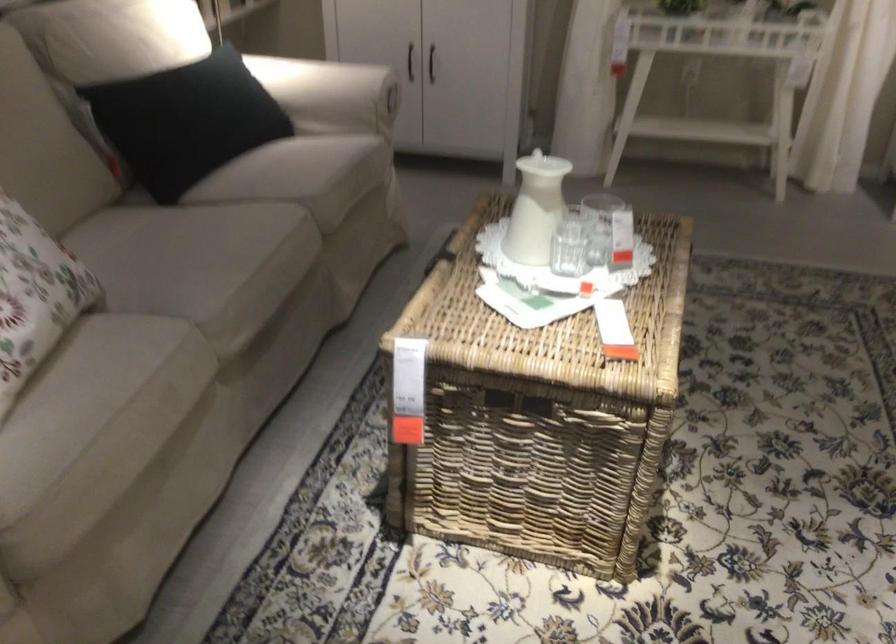
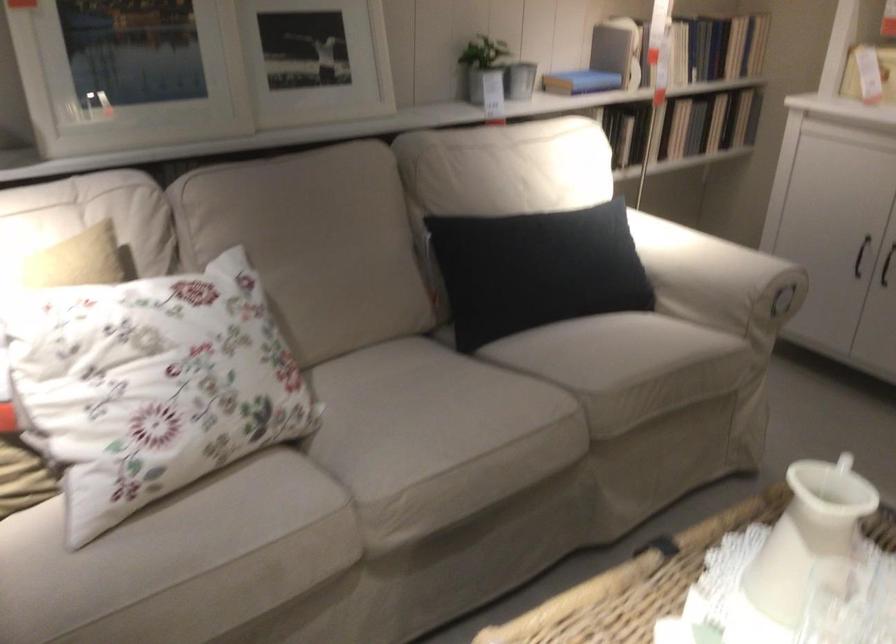
Find the pixel in the second image that matches pixel 339 96 in the first image.

(717, 279)